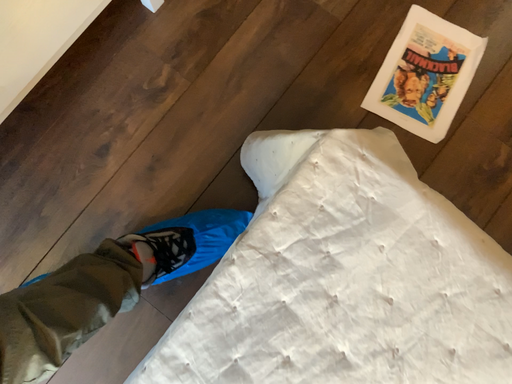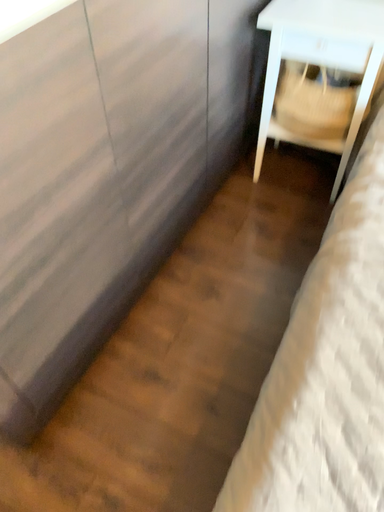
Question: How did the camera likely rotate when shooting the video?

Choices:
 (A) rotated downward
 (B) rotated upward

Answer: (B)